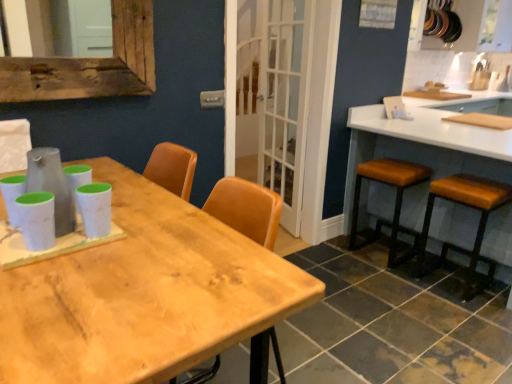
Locate an element on the screen. vacant area situated to the left side of brown leather stool at right, which is the 2th stool in right-to-left order is located at coordinates (335, 258).